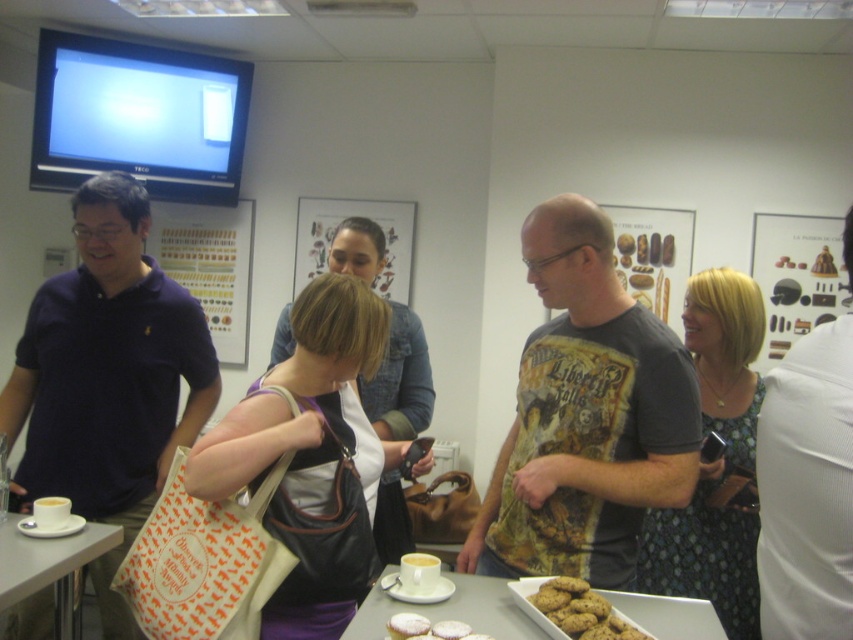
You are standing in the room and want to locate the white fabric shirt at right. According to the coordinates provided, where should you look relative to the center of the image?

The white fabric shirt at right is located at point 0.764 on the x axis and 0.947 on the y axis, which means it is positioned to the right and slightly above the center of the image.

From the picture: You are organizing a party and need to place a new decorative item on the table. Considering the dark blue polo shirt at left and the white glossy table at lower center, which object has a smaller width and would allow more space for the new item?

The dark blue polo shirt at left has a smaller width than the white glossy table at lower center, so placing the new item near it would leave more space.